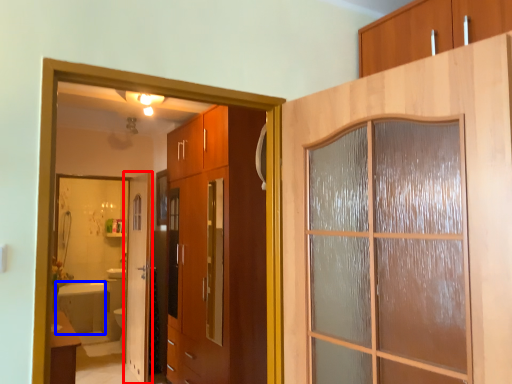
Question: Which object appears farthest to the camera in this image, door (highlighted by a red box) or bath (highlighted by a blue box)?

Choices:
 (A) door
 (B) bath

Answer: (B)